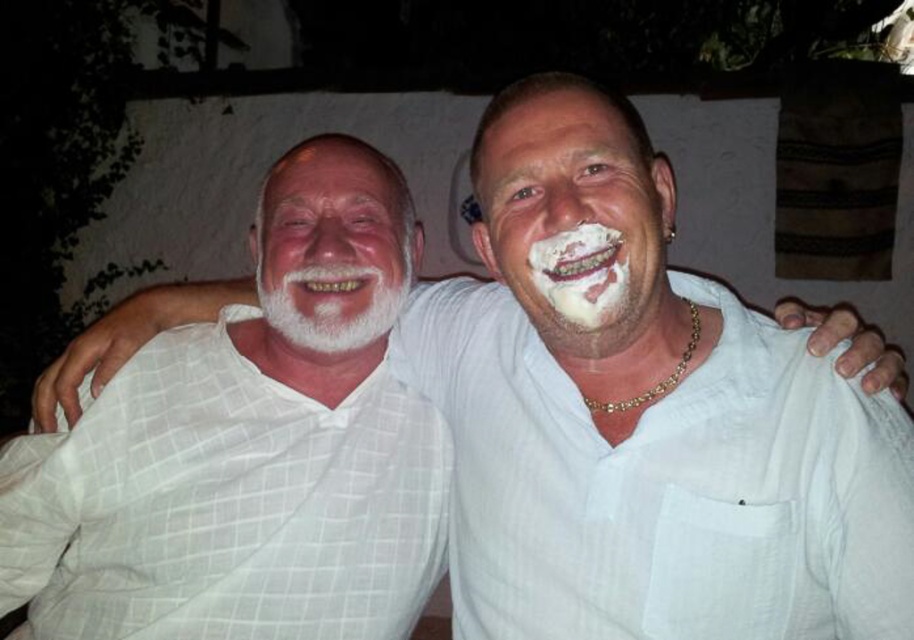
You are a photographer at a party and notice two people sitting together. You see a white checkered shirt at left and a white creamy shaving cream at mouth. Which object is positioned more to the left?

The white checkered shirt at left is positioned more to the left than the white creamy shaving cream at mouth.